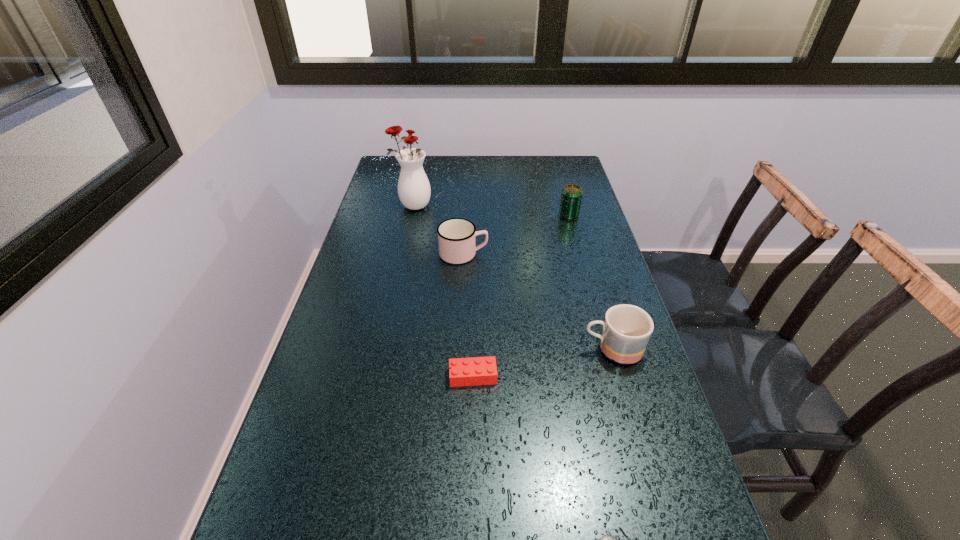
Locate an element on the screen. This screenshot has height=540, width=960. vase is located at coordinates (414, 191).

This screenshot has height=540, width=960. I want to click on the tallest object, so click(414, 191).

Find the location of a particular element. This screenshot has height=540, width=960. beer can is located at coordinates (571, 198).

Find the location of `the right mug`. the right mug is located at coordinates (626, 331).

Find the location of a particular element. The image size is (960, 540). the third farthest object is located at coordinates [456, 237].

Identify the location of the left mug. This screenshot has height=540, width=960. (456, 237).

Find the location of a particular element. The image size is (960, 540). Lego is located at coordinates (472, 371).

Find the location of a particular element. The width and height of the screenshot is (960, 540). vacant space located 0.150m on the front of the vase is located at coordinates (405, 241).

The image size is (960, 540). I want to click on vacant space located on the back of the beer can, so click(562, 189).

Where is `vacant space located 0.130m on the side with the handle of the right mug`? This screenshot has height=540, width=960. vacant space located 0.130m on the side with the handle of the right mug is located at coordinates (528, 349).